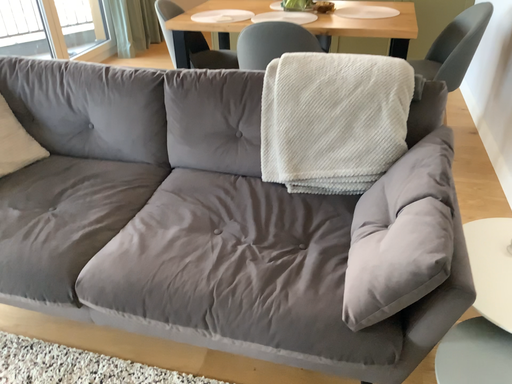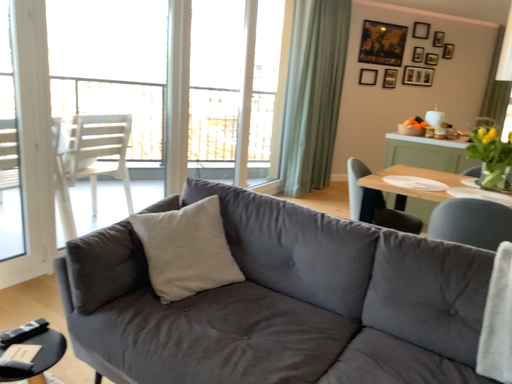
Question: Which way did the camera rotate in the video?

Choices:
 (A) rotated downward
 (B) rotated upward

Answer: (B)